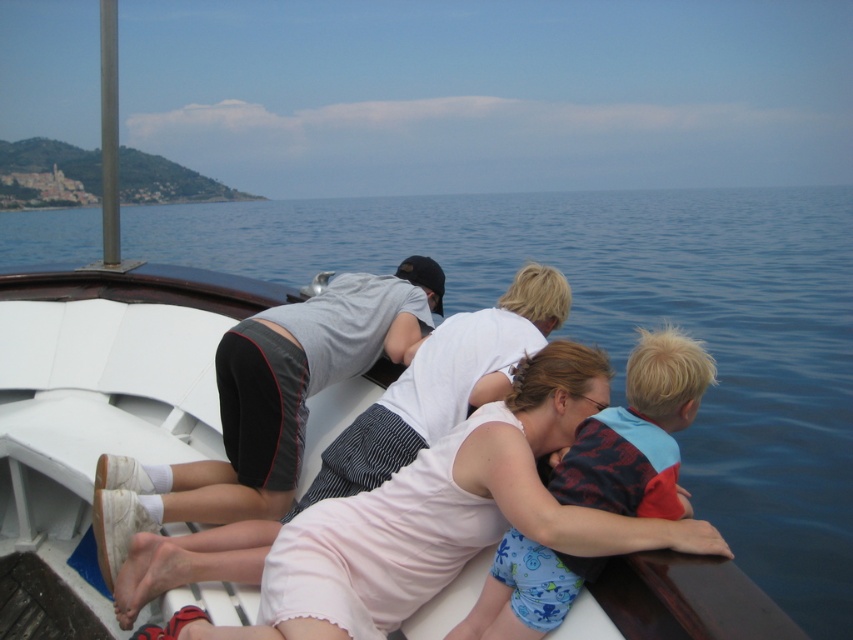
You are a photographer on the boat and want to capture a photo of the white cotton dress at center and the blue water at center. Based on their positions, which object is closer to the camera?

The blue water at center is above the white cotton dress at center, so it is closer to the camera.

You are a photographer trying to capture the scene of the boat ride. Since you want to focus on the blue water at center and the white cotton dress at center, which one should you zoom in on to ensure it takes up more space in your photo?

The blue water at center is larger in size than the white cotton dress at center, so you should zoom in on the blue water at center to ensure it takes up more space in your photo.